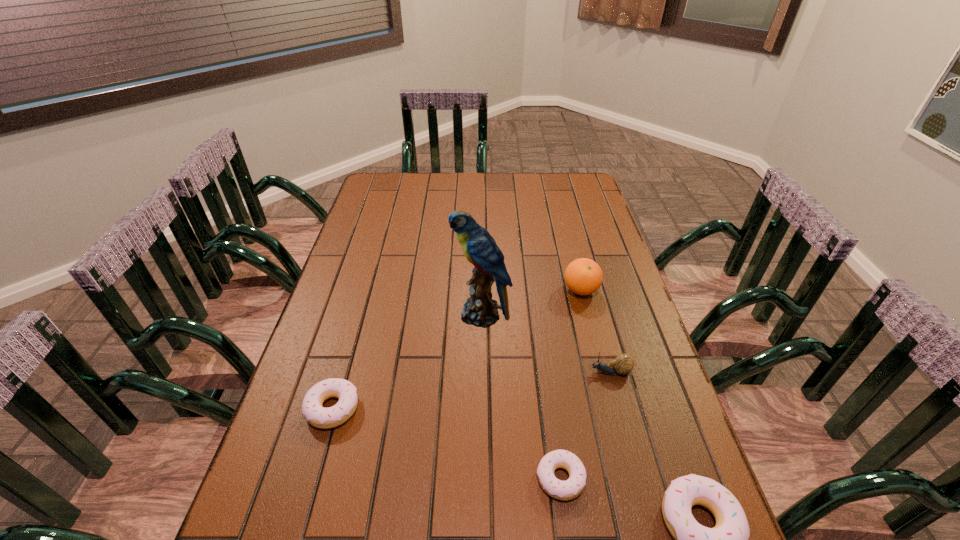
This screenshot has height=540, width=960. What are the coordinates of `the fourth farthest object` in the screenshot? It's located at (318, 416).

The height and width of the screenshot is (540, 960). Identify the location of the leftmost object. (318, 416).

Find the location of `the shortest doughnut`. the shortest doughnut is located at coordinates (566, 490).

I want to click on the shortest object, so click(x=566, y=490).

Where is `orange`? Image resolution: width=960 pixels, height=540 pixels. orange is located at coordinates (583, 276).

This screenshot has width=960, height=540. What are the coordinates of `the second object from left to right` in the screenshot? It's located at (479, 247).

Locate an element on the screen. This screenshot has height=540, width=960. parrot is located at coordinates pos(479,247).

Locate an element on the screen. escargot is located at coordinates (623, 364).

Where is `vacant space located 0.270m on the back of the farthest doughnut`? Image resolution: width=960 pixels, height=540 pixels. vacant space located 0.270m on the back of the farthest doughnut is located at coordinates (361, 309).

I want to click on vacant point located 0.320m on the back of the shortest object, so click(541, 343).